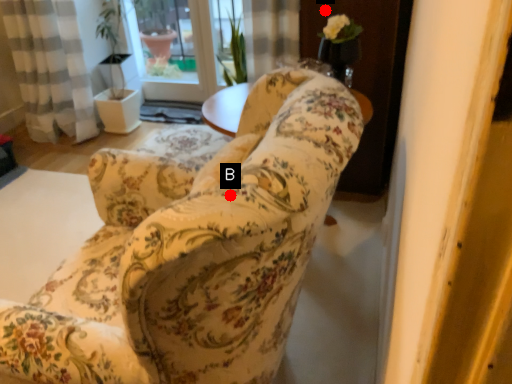
Question: Two points are circled on the image, labeled by A and B beside each circle. Which point is closer to the camera?

Choices:
 (A) A is closer
 (B) B is closer

Answer: (B)